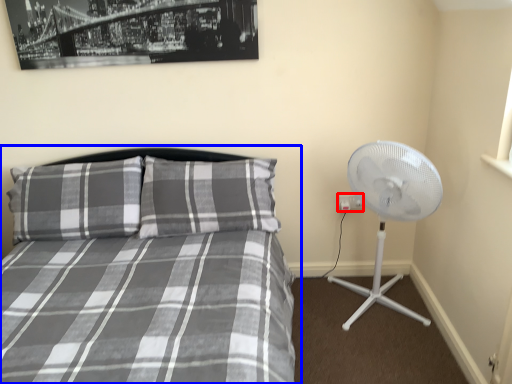
Question: Which object is closer to the camera taking this photo, electric outlet (highlighted by a red box) or bed (highlighted by a blue box)?

Choices:
 (A) electric outlet
 (B) bed

Answer: (B)